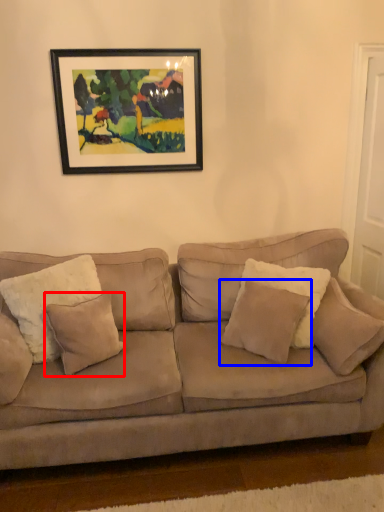
Question: Which object is closer to the camera taking this photo, pillow (highlighted by a red box) or pillow (highlighted by a blue box)?

Choices:
 (A) pillow
 (B) pillow

Answer: (B)